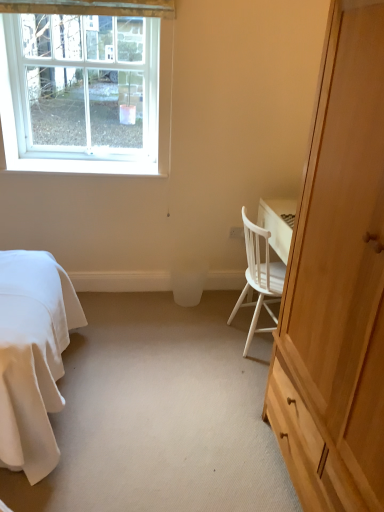
I want to click on white plastic trash bin/can at center, so click(189, 280).

Where is `light wood cabinet at right`? This screenshot has height=512, width=384. light wood cabinet at right is located at coordinates (337, 283).

Find the location of a particular element. The width and height of the screenshot is (384, 512). white plastic trash bin/can at center is located at coordinates (189, 280).

From the image's perspective, relative to white wood chair at right, is white plastic window at upper left above or below?

Based on their image positions, white plastic window at upper left is located above white wood chair at right.

Is point (77, 156) less distant than point (252, 262)?

No.

How much distance is there between white plastic window at upper left and white wood chair at right?

white plastic window at upper left and white wood chair at right are 4.63 feet apart.

From a real-world perspective, which is physically above, white plastic window at upper left or white wood chair at right?

In real-world perspective, white plastic window at upper left is above.

At what (x,y) coordinates should I click in order to perform the action: click on chair located below the white plastic power outlet at center (from the image's perspective). Please return your answer as a coordinate pair (x, y). Looking at the image, I should click on (259, 278).

What's the angular difference between white plastic power outlet at center and white wood chair at right's facing directions?

The angle between the facing direction of white plastic power outlet at center and the facing direction of white wood chair at right is 90 degrees.

Which is correct: white plastic power outlet at center is inside white wood chair at right, or outside of it?

white plastic power outlet at center is spatially situated outside white wood chair at right.

Between white plastic power outlet at center and white wood chair at right, which one has more height?

With more height is white wood chair at right.

Is point (110, 163) behind point (176, 272)?

No, (110, 163) is closer to viewer.

Considering the positions of objects white plastic window at upper left and white plastic trash bin/can at center in the image provided, who is in front, white plastic window at upper left or white plastic trash bin/can at center?

white plastic window at upper left is closer to the camera.

From a real-world perspective, relative to white plastic trash bin/can at center, is white plastic window at upper left vertically above or below?

white plastic window at upper left is above white plastic trash bin/can at center.

Is light wood cabinet at right at the back of white plastic trash bin/can at center?

No, light wood cabinet at right is not at the back of white plastic trash bin/can at center.

Identify the location of trash bin/can below the light wood cabinet at right (from the image's perspective). (189, 280).

Which of these two, white plastic trash bin/can at center or light wood cabinet at right, stands taller?

Standing taller between the two is light wood cabinet at right.

Can you tell me how much white wood chair at right and light wood cabinet at right differ in facing direction?

180 degrees separate the facing orientations of white wood chair at right and light wood cabinet at right.

Is white wood chair at right situated inside light wood cabinet at right or outside?

white wood chair at right is not enclosed by light wood cabinet at right.

Is white wood chair at right behind light wood cabinet at right?

Yes, it is.

In the scene shown: Is white wood chair at right far from light wood cabinet at right?

They are positioned close to each other.

Does white plastic window at upper left have a larger size compared to white plastic power outlet at center?

Indeed, white plastic window at upper left has a larger size compared to white plastic power outlet at center.

From a real-world perspective, which is physically above, white plastic window at upper left or white plastic power outlet at center?

white plastic window at upper left is physically above.

From the image's perspective, which object appears higher, white plastic window at upper left or white plastic power outlet at center?

white plastic window at upper left.

From the picture: Does white plastic window at upper left appear on the right side of white plastic power outlet at center?

No, white plastic window at upper left is not to the right of white plastic power outlet at center.

Is the position of light wood cabinet at right more distant than that of white plastic power outlet at center?

No, light wood cabinet at right is in front of white plastic power outlet at center.

Is light wood cabinet at right next to white plastic power outlet at center and touching it?

There is a gap between light wood cabinet at right and white plastic power outlet at center.

Which point is more forward, (285, 297) or (243, 231)?

The point (285, 297) is more forward.

Where is `chair that appears in front of the white plastic window at upper left`? chair that appears in front of the white plastic window at upper left is located at coordinates (259, 278).

The width and height of the screenshot is (384, 512). Find the location of `power outlet behind the white wood chair at right`. power outlet behind the white wood chair at right is located at coordinates (236, 233).

Estimate the real-world distances between objects in this image. Which object is further from white wood chair at right, light wood cabinet at right or white plastic window at upper left?

white plastic window at upper left lies further to white wood chair at right than the other object.

Estimate the real-world distances between objects in this image. Which object is closer to light wood cabinet at right, white plastic trash bin/can at center or white plastic power outlet at center?

The object closer to light wood cabinet at right is white plastic trash bin/can at center.

Considering their positions, is white plastic power outlet at center positioned further to white wood chair at right than light wood cabinet at right?

The object further to white wood chair at right is light wood cabinet at right.

Based on their spatial positions, is white plastic trash bin/can at center or light wood cabinet at right further from white plastic window at upper left?

light wood cabinet at right.

When comparing their distances from light wood cabinet at right, does white wood chair at right or white plastic power outlet at center seem closer?

white wood chair at right is positioned closer to the anchor light wood cabinet at right.

Based on the photo, considering their positions, is white wood chair at right positioned further to white plastic power outlet at center than light wood cabinet at right?

Among the two, light wood cabinet at right is located further to white plastic power outlet at center.

Estimate the real-world distances between objects in this image. Which object is further from white wood chair at right, light wood cabinet at right or white plastic power outlet at center?

light wood cabinet at right lies further to white wood chair at right than the other object.

Considering their positions, is white plastic window at upper left positioned closer to white plastic power outlet at center than light wood cabinet at right?

The object closer to white plastic power outlet at center is white plastic window at upper left.

Identify the location of power outlet between white plastic window at upper left and white plastic trash bin/can at center from top to bottom. (236, 233).

Locate an element on the screen. The image size is (384, 512). trash bin/can between white wood chair at right and white plastic power outlet at center along the z-axis is located at coordinates (189, 280).

This screenshot has width=384, height=512. Identify the location of power outlet located between white plastic window at upper left and white wood chair at right in the left-right direction. click(236, 233).

In order to click on chair between light wood cabinet at right and white plastic window at upper left along the z-axis in this screenshot , I will do `click(259, 278)`.